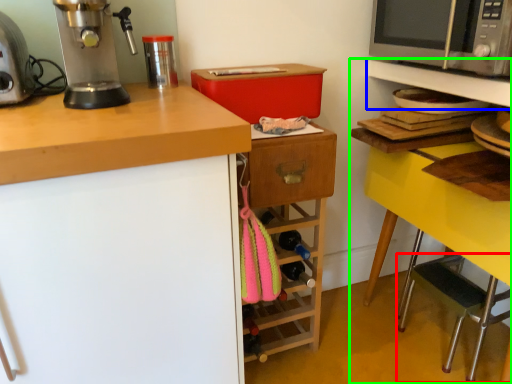
Question: Considering the real-world distances, which object is farthest from step stool (highlighted by a red box)? shelf (highlighted by a blue box) or shelf (highlighted by a green box)?

Choices:
 (A) shelf
 (B) shelf

Answer: (A)